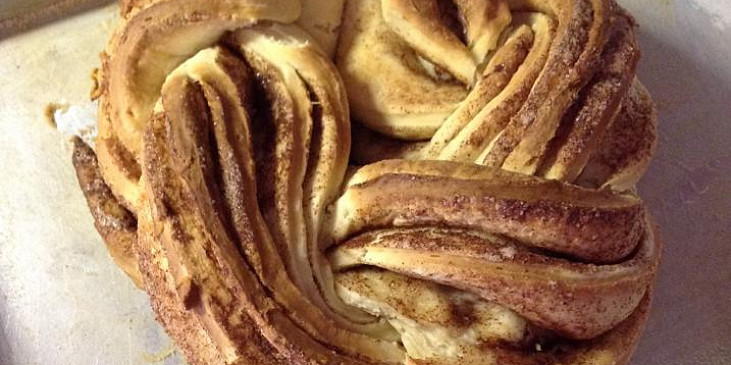
I want to click on counter top, so click(x=49, y=262).